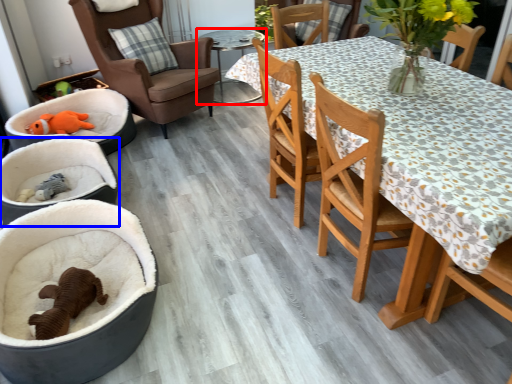
Question: Among these objects, which one is nearest to the camera, table (highlighted by a red box) or baby carriage (highlighted by a blue box)?

Choices:
 (A) table
 (B) baby carriage

Answer: (B)